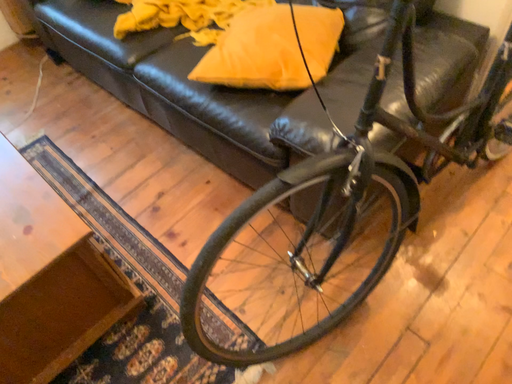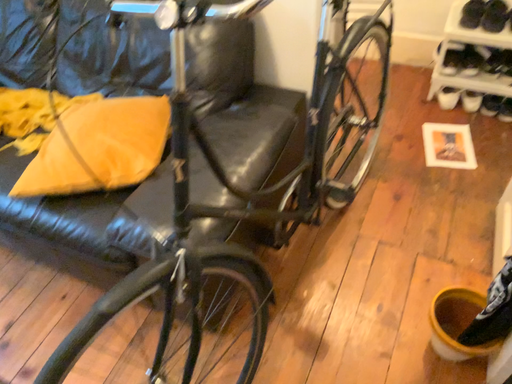
Question: Which way did the camera rotate in the video?

Choices:
 (A) rotated downward
 (B) rotated upward

Answer: (B)